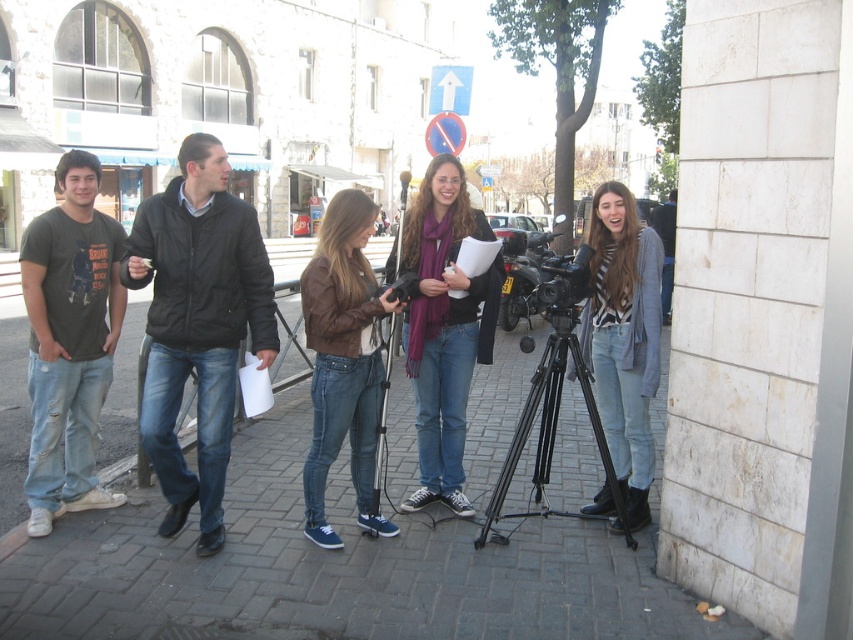
Question: Is brick pavement at center thinner than black matte jacket at center?

Choices:
 (A) yes
 (B) no

Answer: (B)

Question: Is black plastic video camera at center to the left of dark gray jacket at center from the viewer's perspective?

Choices:
 (A) yes
 (B) no

Answer: (A)

Question: Is brick pavement at center further to camera compared to striped knit sweater at center?

Choices:
 (A) yes
 (B) no

Answer: (B)

Question: Considering the real-world distances, which object is closest to the brick pavement at center?

Choices:
 (A) black metal tripod at center
 (B) matte black t-shirt at left

Answer: (A)

Question: Among these objects, which one is nearest to the camera?

Choices:
 (A) matte black t-shirt at left
 (B) black metal tripod at center
 (C) brick pavement at center

Answer: (C)

Question: Which object is closer to the camera taking this photo?

Choices:
 (A) brick pavement at center
 (B) brown leather jacket at center
 (C) black plastic video camera at center
 (D) matte black t-shirt at left

Answer: (A)